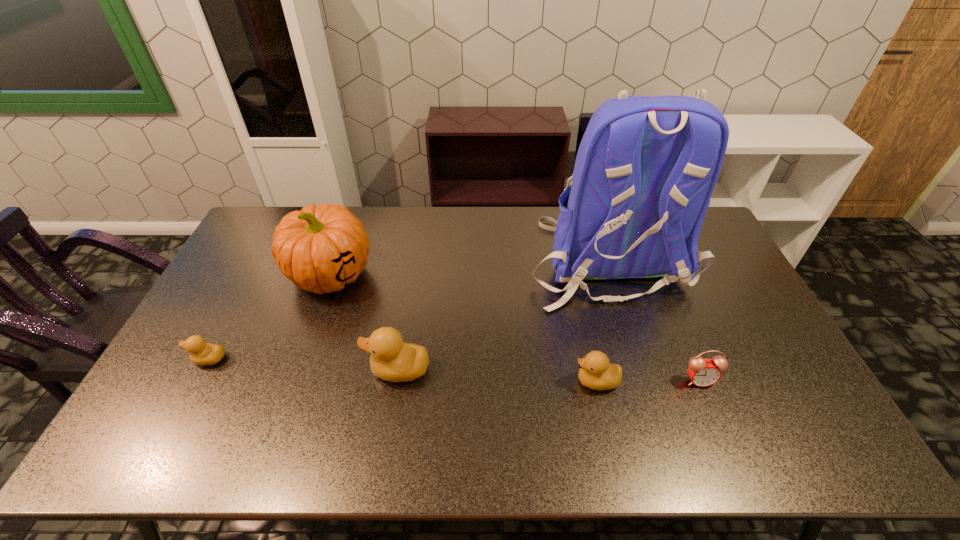
Where is `alarm clock located in the near edge section of the desktop`? The image size is (960, 540). alarm clock located in the near edge section of the desktop is located at coordinates (703, 372).

Find the location of a particular element. The width and height of the screenshot is (960, 540). object located in the left edge section of the desktop is located at coordinates (201, 353).

The image size is (960, 540). Find the location of `object that is at the right edge`. object that is at the right edge is located at coordinates (646, 167).

Where is `object that is positioned at the far right corner`? The image size is (960, 540). object that is positioned at the far right corner is located at coordinates (646, 167).

Locate an element on the screen. vacant space at the near edge of the desktop is located at coordinates (365, 411).

I want to click on free space at the left edge of the desktop, so click(x=223, y=306).

Identify the location of vacant space at the far left corner of the desktop. (299, 210).

You are a GUI agent. You are given a task and a screenshot of the screen. Output one action in this format:
    pyautogui.click(x=<x>, y=<y>)
    Task: Click on the free space between the backpack and the alarm clock
    
    Given the screenshot: What is the action you would take?
    pyautogui.click(x=654, y=320)

You are a GUI agent. You are given a task and a screenshot of the screen. Output one action in this format:
    pyautogui.click(x=<x>, y=<y>)
    Task: Click on the free space that is in between the leftmost object and the backpack
    
    Given the screenshot: What is the action you would take?
    pyautogui.click(x=409, y=309)

Identify the location of vacant area between the third tallest object and the alarm clock. This screenshot has height=540, width=960. click(548, 375).